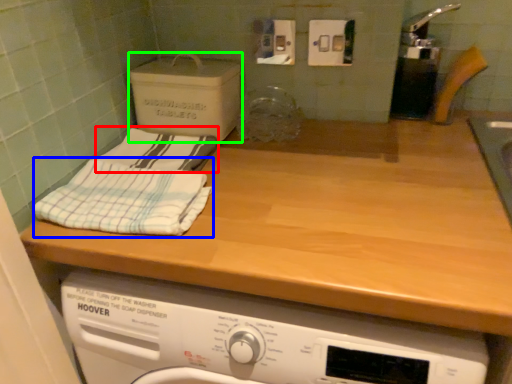
Question: Which object is positioned farthest from bath towel (highlighted by a red box)? Select from bath towel (highlighted by a blue box) and cardboard box (highlighted by a green box).

Choices:
 (A) bath towel
 (B) cardboard box

Answer: (A)